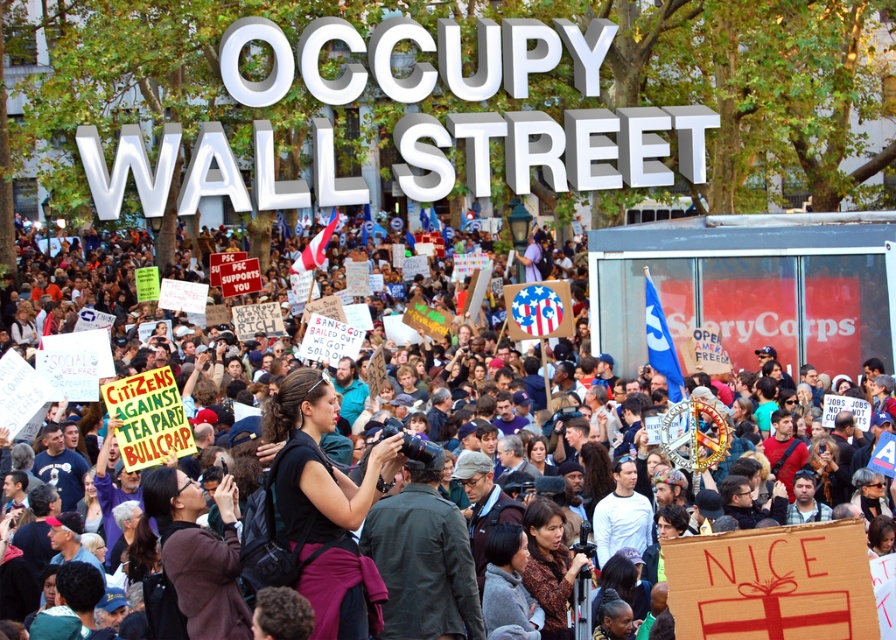
Is black fabric camera at center to the right of brown leather jacket at center from the viewer's perspective?

Yes, black fabric camera at center is to the right of brown leather jacket at center.

Who is positioned more to the left, black fabric camera at center or brown leather jacket at center?

brown leather jacket at center is more to the left.

The width and height of the screenshot is (896, 640). In order to click on black fabric camera at center in this screenshot , I will do `click(325, 506)`.

Is black fabric camera at center shorter than brown patterned dress at lower center?

No, black fabric camera at center is not shorter than brown patterned dress at lower center.

Is point (295, 515) closer to camera compared to point (552, 593)?

Yes.

What are the coordinates of `black fabric camera at center` in the screenshot? It's located at (325, 506).

Does white cardboard signs at center have a lesser width compared to brown leather jacket at center?

In fact, white cardboard signs at center might be wider than brown leather jacket at center.

Who is positioned more to the left, white cardboard signs at center or brown leather jacket at center?

Positioned to the left is white cardboard signs at center.

The height and width of the screenshot is (640, 896). I want to click on white cardboard signs at center, so click(761, 305).